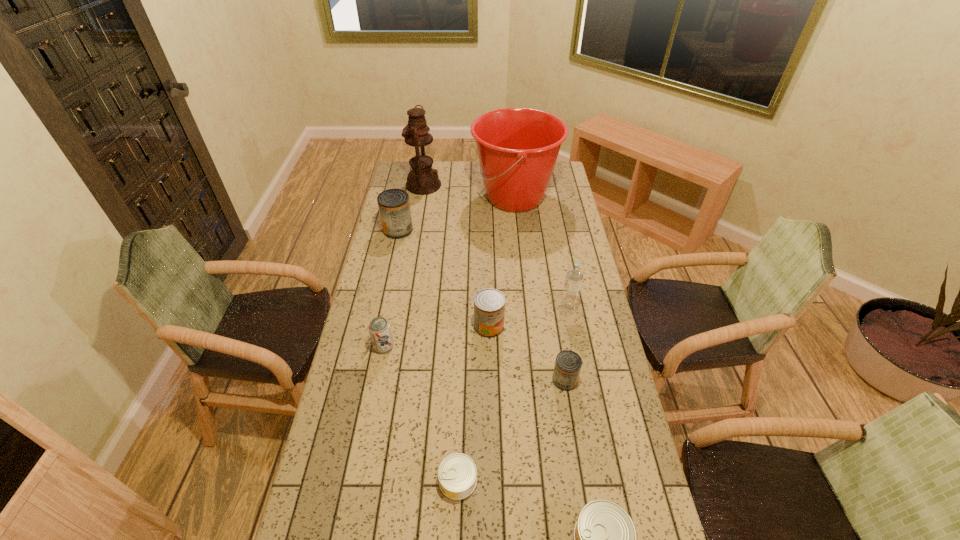
Where is `vacant position located on the front of the seventh tallest object`? The height and width of the screenshot is (540, 960). vacant position located on the front of the seventh tallest object is located at coordinates (588, 526).

The height and width of the screenshot is (540, 960). What are the coordinates of `vacant space located 0.200m on the right of the left silver can` in the screenshot? It's located at (549, 480).

The height and width of the screenshot is (540, 960). In order to click on oil lamp that is positioned at the far edge in this screenshot , I will do tap(422, 180).

In order to click on bucket situated at the far edge in this screenshot , I will do `click(517, 148)`.

In order to click on oil lamp present at the left edge in this screenshot , I will do `click(422, 180)`.

Locate an element on the screen. The height and width of the screenshot is (540, 960). can that is at the left edge is located at coordinates (394, 207).

Where is `beer can situated at the left edge`? The height and width of the screenshot is (540, 960). beer can situated at the left edge is located at coordinates (379, 328).

Image resolution: width=960 pixels, height=540 pixels. Find the location of `bucket at the right edge`. bucket at the right edge is located at coordinates [517, 148].

In order to click on water bottle positioned at the right edge in this screenshot , I will do `click(574, 275)`.

At what (x,y) coordinates should I click in order to perform the action: click on can at the right edge. Please return your answer as a coordinate pair (x, y). Looking at the image, I should click on (568, 364).